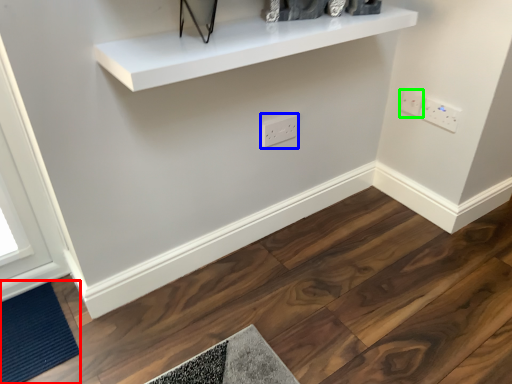
Question: Estimate the real-world distances between objects in this image. Which object is farther from doormat (highlighted by a red box), electric outlet (highlighted by a blue box) or electric outlet (highlighted by a green box)?

Choices:
 (A) electric outlet
 (B) electric outlet

Answer: (B)